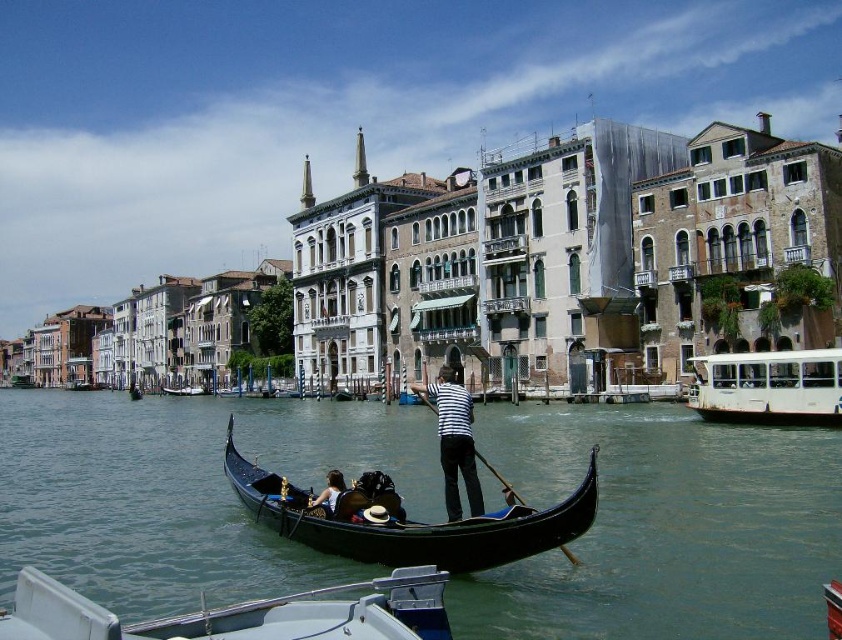
You are a tourist in Venice and want to take a boat ride. You see the clear water at gondola center and the white plastic boat at lower center. Which one is larger?

The clear water at gondola center is bigger than the white plastic boat at lower center.

You are a tourist standing on the canal bridge and want to take a photo of both the clear water at gondola center and the white plastic boat at lower center. Which object will appear closer to the camera in your photo?

The clear water at gondola center will appear closer to the camera in your photo because it is further to the viewer than the white plastic boat at lower center.

You are a tourist standing on the canal bridge and want to take a photo of the clear water at gondola center and the white plastic boat at lower center. The camera you have can focus on objects up to 20 meters away. Will both objects be in focus?

The clear water at gondola center is 21.78 meters away from the white plastic boat at lower center. Since the camera can focus up to 20 meters, the distance between them exceeds the camera range. Therefore, both objects cannot be in focus simultaneously.